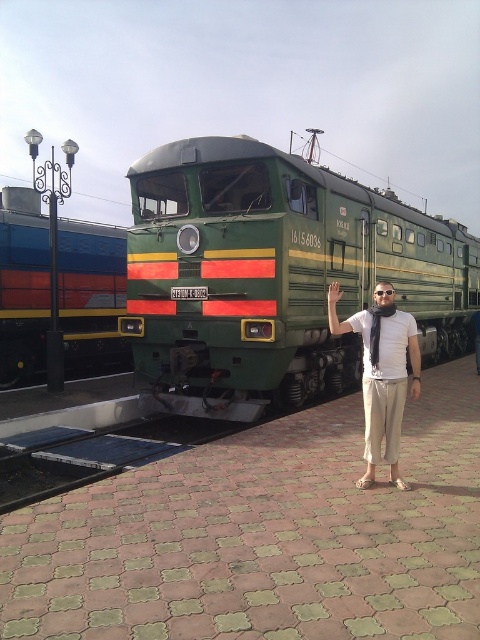
Question: Among these points, which one is nearest to the camera?

Choices:
 (A) (478, 353)
 (B) (233, 269)
 (C) (386, 388)

Answer: (C)

Question: Considering the real-world distances, which object is farthest from the metallic green train at left?

Choices:
 (A) matte white shirt at center
 (B) matte green scarf at center

Answer: (B)

Question: Is green matte train at center bigger than matte white shirt at center?

Choices:
 (A) no
 (B) yes

Answer: (B)

Question: Can you confirm if green matte train at center is bigger than metallic green train at left?

Choices:
 (A) no
 (B) yes

Answer: (B)

Question: Does green matte train at center appear on the right side of metallic green train at left?

Choices:
 (A) yes
 (B) no

Answer: (A)

Question: Among these points, which one is nearest to the camera?

Choices:
 (A) (384, 323)
 (B) (476, 326)
 (C) (10, 332)
 (D) (394, 262)

Answer: (A)